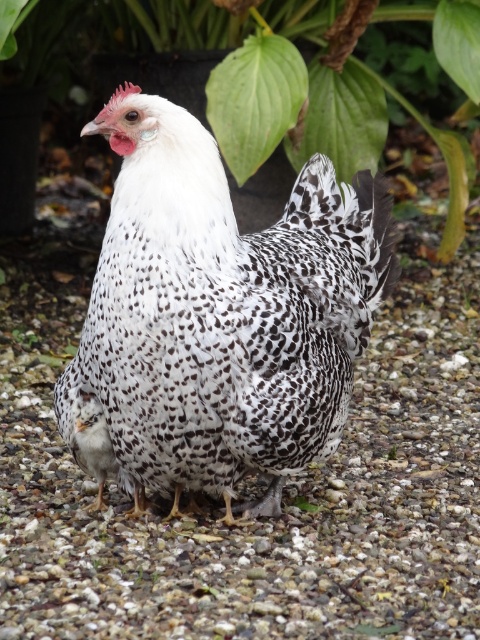
Question: Estimate the real-world distances between objects in this image. Which object is closer to the white gravel at center?

Choices:
 (A) speckled feathered chicken at center
 (B) green leafy plant at upper center

Answer: (A)

Question: Can you confirm if white gravel at center is wider than speckled feathered chicken at center?

Choices:
 (A) yes
 (B) no

Answer: (A)

Question: Which of the following is the farthest from the observer?

Choices:
 (A) (196, 122)
 (B) (307, 0)

Answer: (B)

Question: Observing the image, what is the correct spatial positioning of white gravel at center in reference to green leafy plant at upper center?

Choices:
 (A) left
 (B) right

Answer: (B)

Question: Which object is closer to the camera taking this photo?

Choices:
 (A) green leafy plant at upper center
 (B) speckled feathered chicken at center

Answer: (B)

Question: Is the position of white gravel at center less distant than that of speckled feathered chicken at center?

Choices:
 (A) yes
 (B) no

Answer: (A)